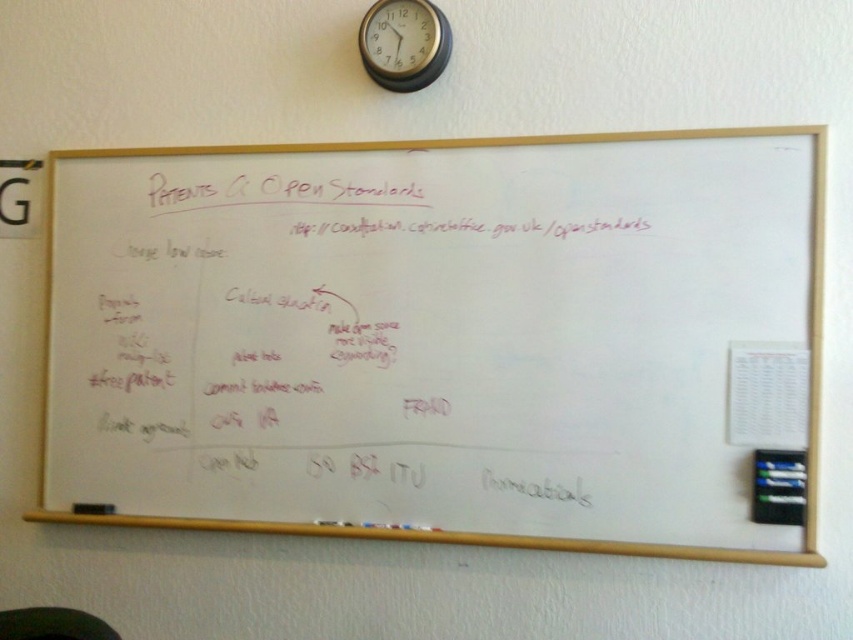
Is point (225, 316) behind point (426, 70)?

Yes, it is behind point (426, 70).

Who is more distant from viewer, (582, 147) or (439, 19)?

The point (439, 19) is more distant.

The height and width of the screenshot is (640, 853). I want to click on whiteboard at center, so click(431, 337).